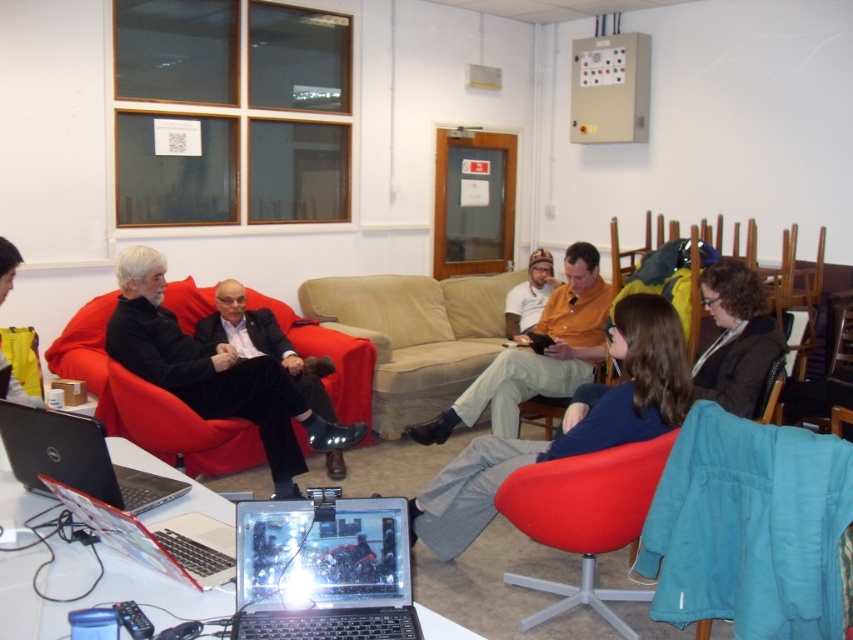
You are organizing a small event and need to place a 6.5 feet long banner between the brown woolen sweater at lower right and the silver metallic laptop at lower center. Will there be enough space?

The brown woolen sweater at lower right and silver metallic laptop at lower center are 7.10 feet apart from each other. Since the banner is 6.5 feet long, it will fit between them with 0.6 feet of space remaining.

You are standing in the meeting room and want to determine which of the two points, point (28, 476) or point (16, 390), is closer to you. Based on the spatial relationship between them, which point is nearer?

Point (28, 476) is closer to the viewer than point (16, 390).

You are organizing a presentation and need to place a projector on the table. The projector requires a surface height of at least 10 cm. Given the silver metallic laptop at lower left and the yellow fabric at lower left, which object can you use as a base to meet the height requirement?

The yellow fabric at lower left is taller than the silver metallic laptop at lower left, so the yellow fabric at lower left can be used as a base to meet the projector height requirement of at least 10 cm.